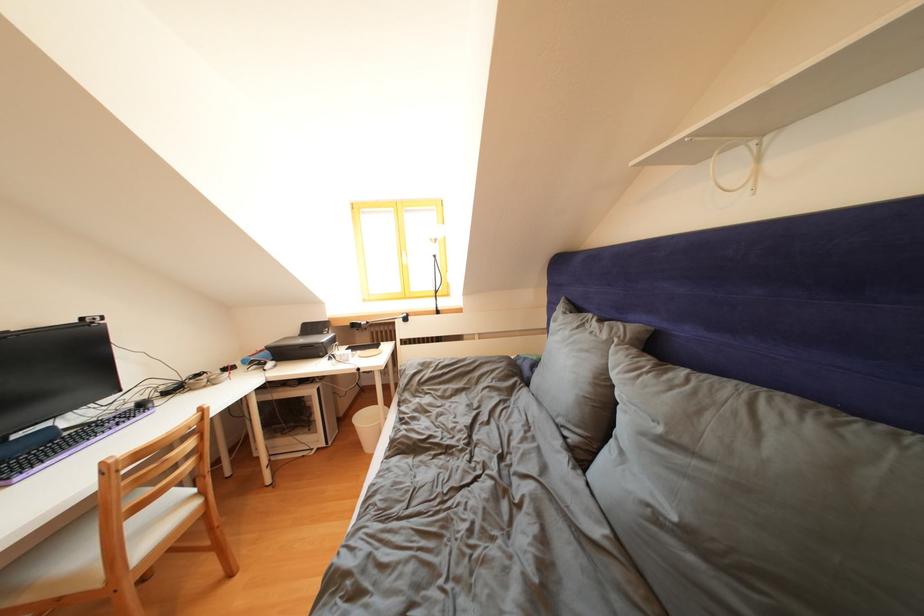
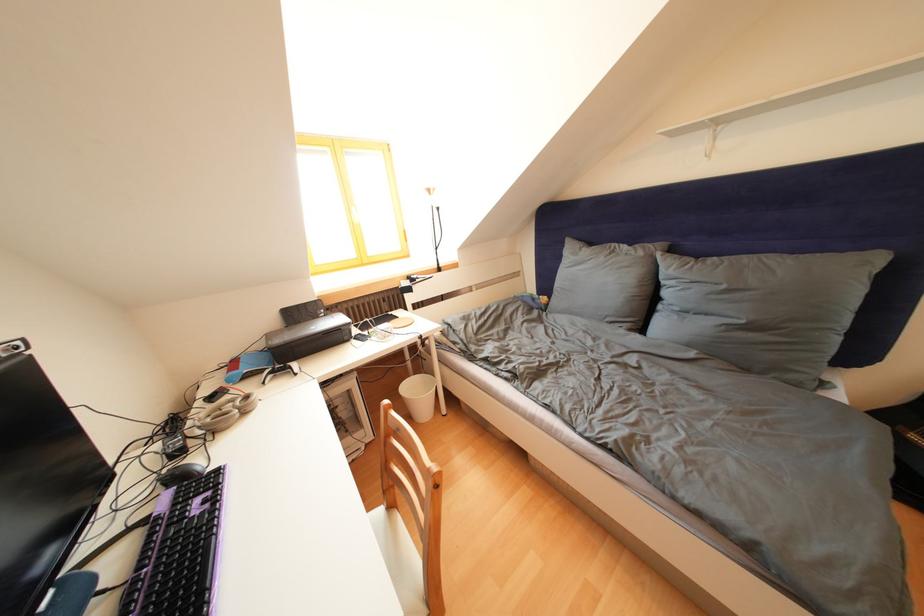
Find the pixel in the second image that matches the point at 438,310 in the first image.

(440, 268)